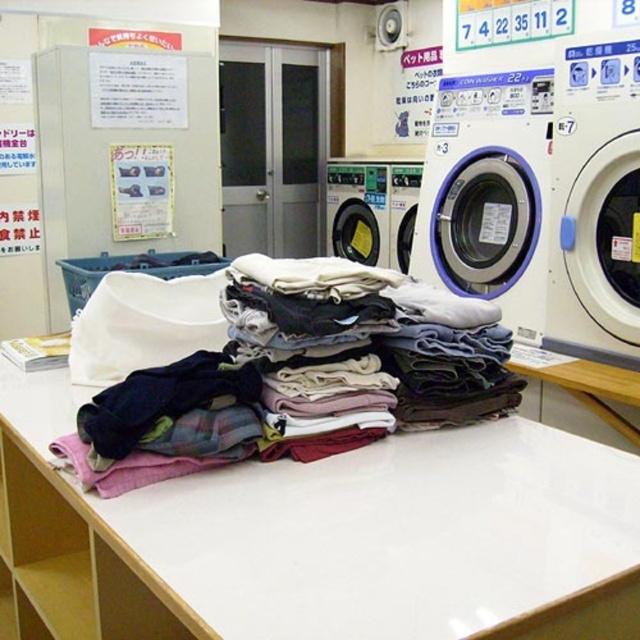
You are standing at the entrance of the laundromat and see two points marked on the floor. The first point is labeled as point (244, 314) and the second is point (326, 188). Which point is closer to you?

Point (244, 314) is closer to you because it is in front of point (326, 188).

You are organizing laundry at the laundromat and need to place the multicolored fabric at center and the metallic gray washing machine at center in a specific order. According to the image, which object is located to the left of the other?

The multicolored fabric at center is positioned on the left side of metallic gray washing machine at center.

You are at a laundromat and need to choose between the metallic gray washing machine at center and the white plastic washing machine at center. Which one has a bigger capacity for your laundry?

The metallic gray washing machine at center is larger in size than the white plastic washing machine at center, so it likely has a bigger capacity for your laundry.